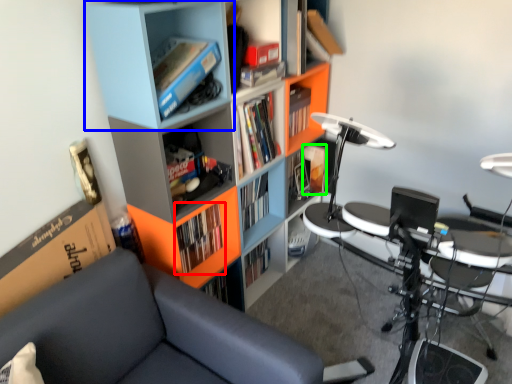
Question: Considering the real-world distances, which object is closest to book (highlighted by a red box)? shelf (highlighted by a blue box) or book (highlighted by a green box).

Choices:
 (A) shelf
 (B) book

Answer: (A)